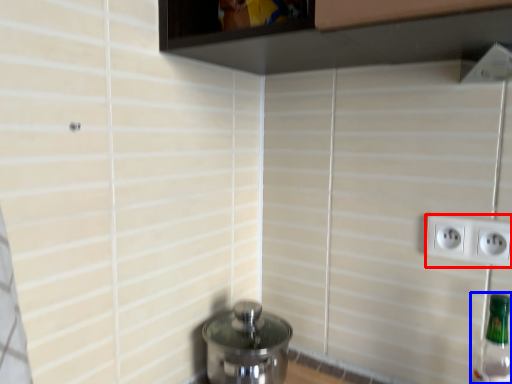
Question: Which of the following is the closest to the observer, power plugs and sockets (highlighted by a red box) or bottle (highlighted by a blue box)?

Choices:
 (A) power plugs and sockets
 (B) bottle

Answer: (B)